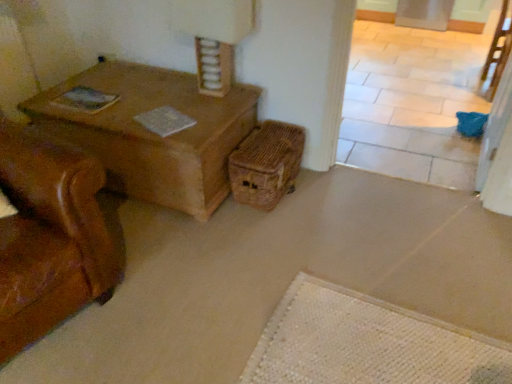
Question: Are woven brown basket at lower right and brown woven chair at upper right far apart?

Choices:
 (A) yes
 (B) no

Answer: (A)

Question: From a real-world perspective, does woven brown basket at lower right stand above brown woven chair at upper right?

Choices:
 (A) yes
 (B) no

Answer: (B)

Question: Does woven brown basket at lower right have a smaller size compared to brown woven chair at upper right?

Choices:
 (A) yes
 (B) no

Answer: (A)

Question: Is woven brown basket at lower right to the left of brown woven chair at upper right from the viewer's perspective?

Choices:
 (A) no
 (B) yes

Answer: (B)

Question: Does woven brown basket at lower right have a lesser width compared to brown woven chair at upper right?

Choices:
 (A) yes
 (B) no

Answer: (B)

Question: Is woven brown basket at lower right behind brown woven chair at upper right?

Choices:
 (A) no
 (B) yes

Answer: (A)

Question: Can you confirm if brown woven chair at upper right is wider than woven brown basket at lower right?

Choices:
 (A) no
 (B) yes

Answer: (A)

Question: Is brown woven chair at upper right oriented away from woven brown basket at lower right?

Choices:
 (A) yes
 (B) no

Answer: (B)

Question: Can you confirm if brown woven chair at upper right is shorter than woven brown basket at lower right?

Choices:
 (A) yes
 (B) no

Answer: (B)

Question: Does brown woven chair at upper right turn towards woven brown basket at lower right?

Choices:
 (A) yes
 (B) no

Answer: (B)

Question: Would you consider brown woven chair at upper right to be distant from woven brown basket at lower right?

Choices:
 (A) yes
 (B) no

Answer: (A)

Question: Considering the relative sizes of brown woven chair at upper right and woven brown basket at lower right in the image provided, is brown woven chair at upper right thinner than woven brown basket at lower right?

Choices:
 (A) no
 (B) yes

Answer: (B)

Question: Is woven brown basket at lower right in front of or behind brown woven chair at upper right in the image?

Choices:
 (A) front
 (B) behind

Answer: (A)